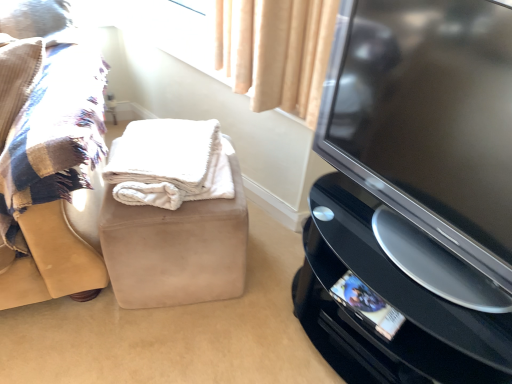
The width and height of the screenshot is (512, 384). I want to click on free point above black glossy tv at right (from a real-world perspective), so click(x=416, y=270).